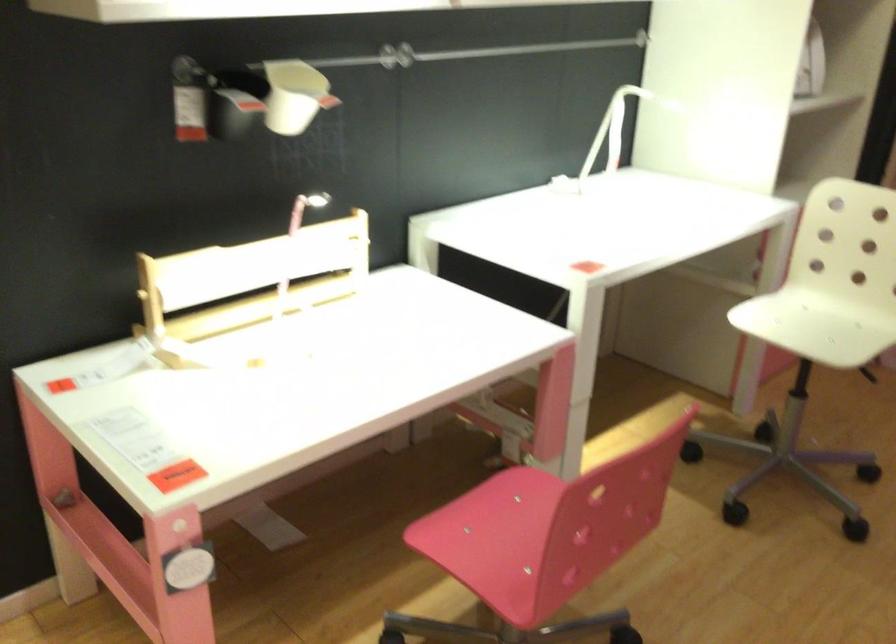
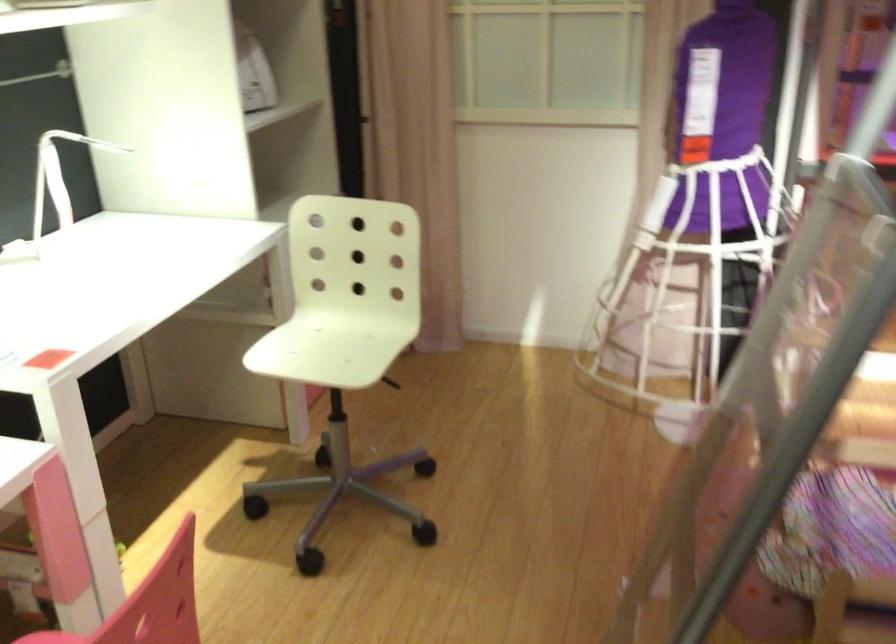
Locate, in the second image, the point that corresponds to (x=814, y=326) in the first image.

(331, 345)